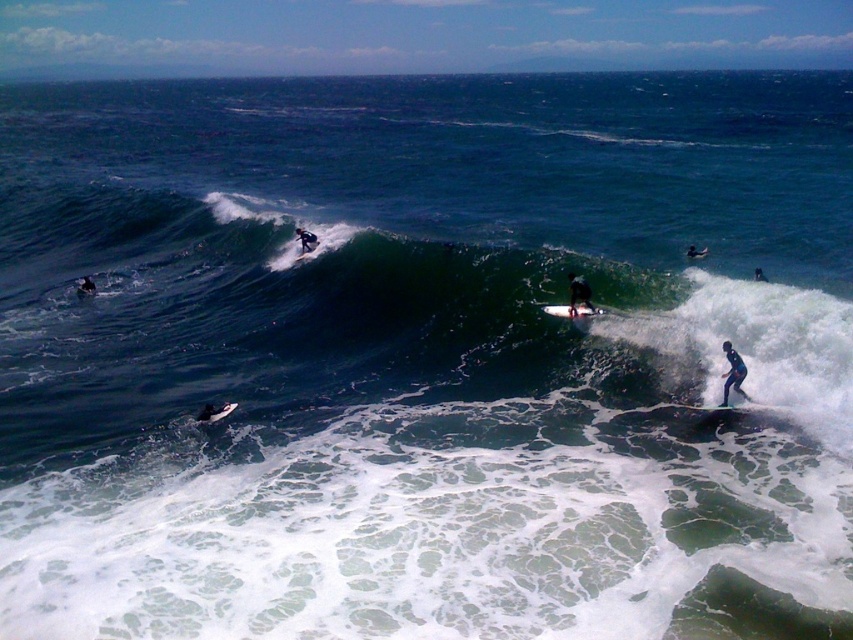
You are a photographer trying to capture the surfer in the black matte wetsuit at lower right. Based on their position coordinates, where should you aim your camera to ensure the surfer is centered in your shot?

The black matte wetsuit at lower right is located at coordinates point (732, 371), so you should aim your camera at those coordinates to center the surfer in your shot.

You are a surfer who wants to choose a surfboard that is wider for better stability. Based on the image, which surfboard between the white foam surfboard at center and the black matte surfboard at lower left would you recommend?

The white foam surfboard at center has a larger width than the black matte surfboard at lower left, so it would provide better stability for surfing.

You are a surfer who wants to choose a surfboard that is bigger than the other one. Which one should you pick between the white foam surfboard at center and the black matte surfboard at lower left?

The white foam surfboard at center is larger in size compared to the black matte surfboard at lower left, so you should pick the white foam surfboard at center.